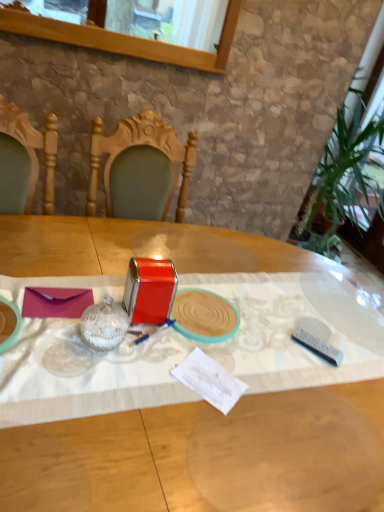
Question: Looking at their shapes, would you say metallic red tin at center, the third tableware from the right, is wider or thinner than metallic red tin at center, marked as the third tableware in a left-to-right arrangement?

Choices:
 (A) wide
 (B) thin

Answer: (B)

Question: From a real-world perspective, is metallic red tin at center, the third tableware from the right, above or below metallic red tin at center, marked as the 2th tableware in a right-to-left arrangement?

Choices:
 (A) below
 (B) above

Answer: (B)

Question: Which object is the farthest from the metallic red tin at center, positioned as the second tableware in left-to-right order?

Choices:
 (A) metallic red tin at center
 (B) purple matte envelope at center
 (C) white plastic remote at lower right, acting as the 4th tableware starting from the left
 (D) metallic red tin at center, marked as the third tableware in a left-to-right arrangement
 (E) clear glass window at upper center

Answer: (E)

Question: Estimate the real-world distances between objects in this image. Which object is closer to the metallic red tin at center?

Choices:
 (A) white plastic remote at lower right, the first tableware when ordered from right to left
 (B) metallic red tin at center, positioned as the second tableware in left-to-right order
 (C) purple matte envelope at center
 (D) clear glass window at upper center
 (E) metallic red tin at center, marked as the third tableware in a left-to-right arrangement

Answer: (B)